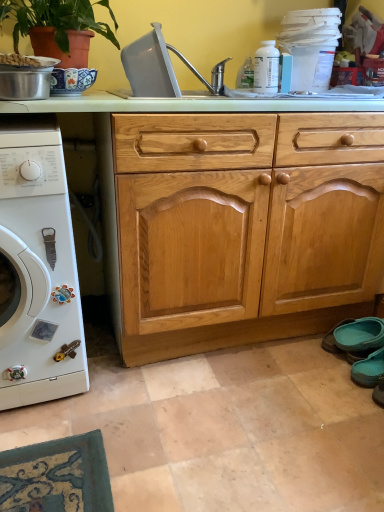
Question: Is light wood/texture drawer at center wider or thinner than gray plastic sink at upper center?

Choices:
 (A) wide
 (B) thin

Answer: (A)

Question: In terms of size, does light wood/texture drawer at center appear bigger or smaller than gray plastic sink at upper center?

Choices:
 (A) small
 (B) big

Answer: (B)

Question: Which object is positioned farthest from the white matte washing machine at left?

Choices:
 (A) teal fabric shoe at lower right, which is the 1th shoe in back-to-front order
 (B) light wood/texture drawer at center
 (C) metallic silver pot at upper left
 (D) teal fabric slipper at lower right, which is the 2th shoe in back-to-front order
 (E) terracotta clay pot at upper left

Answer: (D)

Question: Based on their relative distances, which object is nearer to the terracotta clay pot at upper left?

Choices:
 (A) metallic silver pot at upper left
 (B) teal fabric shoe at lower right, placed as the second shoe when sorted from front to back
 (C) light wood/texture drawer at center
 (D) teal fabric slipper at lower right, the 1th shoe viewed from the front
 (E) white matte washing machine at left

Answer: (A)